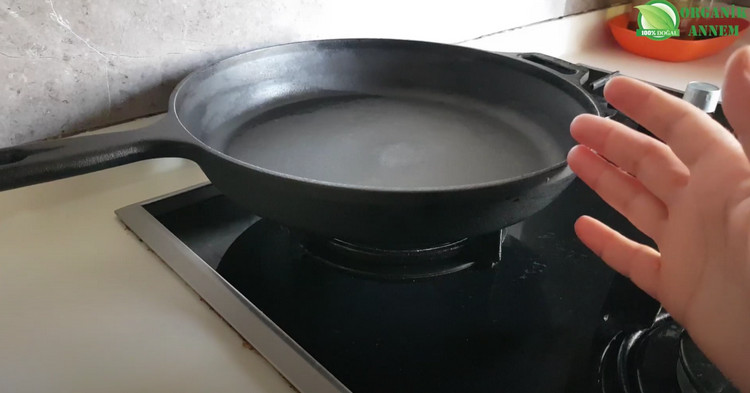
This screenshot has height=393, width=750. Identify the location of left front burner of stove. (693, 375), (627, 342).